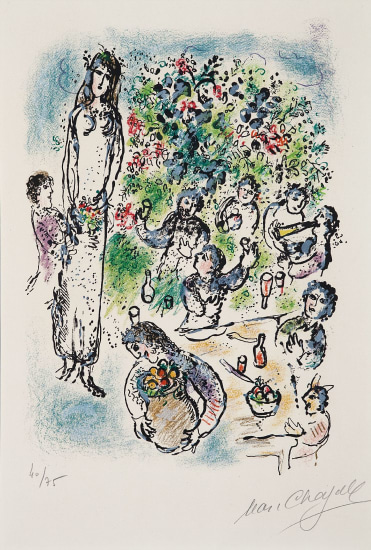
Locate an element on the screen. The height and width of the screenshot is (550, 371). drinking glasses is located at coordinates (241, 361), (366, 351), (284, 282), (140, 314).